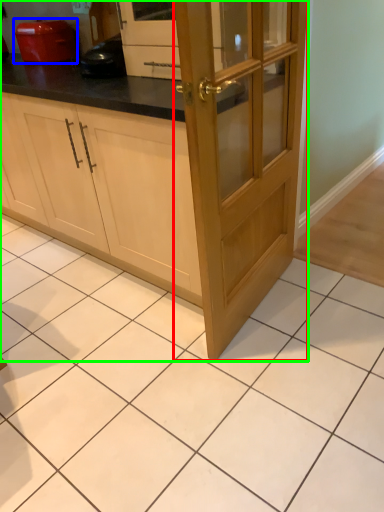
Question: Which object is positioned closest to door (highlighted by a red box)? Select from home appliance (highlighted by a blue box) and cabinetry (highlighted by a green box).

Choices:
 (A) home appliance
 (B) cabinetry

Answer: (B)